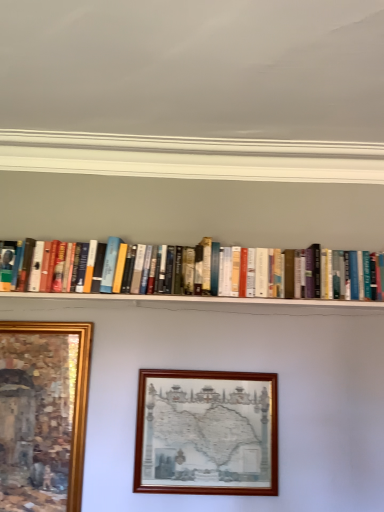
Describe the element at coordinates (120, 269) in the screenshot. The width and height of the screenshot is (384, 512). I see `hardcover books at center` at that location.

Measure the distance between point (260,277) and camera.

They are 5.50 feet apart.

What is the approximate width of wooden picture frame at center, placed as the 1th picture frame when sorted from right to left?

It is 2.60 inches.

You are a GUI agent. You are given a task and a screenshot of the screen. Output one action in this format:
    pyautogui.click(x=<x>, y=<y>)
    Task: Click on the hardcover books at center
    The width and height of the screenshot is (384, 512).
    Given the screenshot: What is the action you would take?
    pyautogui.click(x=120, y=269)

Where is `book behind the wooden picture frame at center, which is the second picture frame in left-to-right order`? book behind the wooden picture frame at center, which is the second picture frame in left-to-right order is located at coordinates (120, 269).

Is wooden picture frame at center, placed as the 1th picture frame when sorted from right to left, wider or thinner than hardcover books at center?

Clearly, wooden picture frame at center, placed as the 1th picture frame when sorted from right to left, has less width compared to hardcover books at center.

Considering their positions, is wooden picture frame at center, placed as the 1th picture frame when sorted from right to left, located in front of or behind hardcover books at center?

In the image, wooden picture frame at center, placed as the 1th picture frame when sorted from right to left, appears in front of hardcover books at center.

From the image's perspective, is wooden picture frame at center, which is the second picture frame in left-to-right order, located above or below hardcover books at center?

From the image's perspective, wooden picture frame at center, which is the second picture frame in left-to-right order, appears below hardcover books at center.

Identify the location of picture frame on the left of wooden picture frame at center, which is the second picture frame in left-to-right order. The height and width of the screenshot is (512, 384). (43, 414).

Consider the image. Which is correct: wooden picture frame at center, which is the second picture frame in left-to-right order, is inside gold-framed painting at lower left, the 2th picture frame viewed from the right, or outside of it?

Answer: wooden picture frame at center, which is the second picture frame in left-to-right order, is located beyond the bounds of gold-framed painting at lower left, the 2th picture frame viewed from the right.

Is the depth of wooden picture frame at center, which is the second picture frame in left-to-right order, greater than that of gold-framed painting at lower left, which is the 1th picture frame in left-to-right order?

Yes, it is behind gold-framed painting at lower left, which is the 1th picture frame in left-to-right order.

Would you consider wooden picture frame at center, which is the second picture frame in left-to-right order, to be distant from gold-framed painting at lower left, which is the 1th picture frame in left-to-right order?

That's not correct — wooden picture frame at center, which is the second picture frame in left-to-right order, is a little close to gold-framed painting at lower left, which is the 1th picture frame in left-to-right order.

Is gold-framed painting at lower left, the 2th picture frame viewed from the right, positioned in front of wooden picture frame at center, placed as the 1th picture frame when sorted from right to left?

Yes.

Is wooden picture frame at center, placed as the 1th picture frame when sorted from right to left, located within gold-framed painting at lower left, which is the 1th picture frame in left-to-right order?

No, wooden picture frame at center, placed as the 1th picture frame when sorted from right to left, is located outside of gold-framed painting at lower left, which is the 1th picture frame in left-to-right order.

The width and height of the screenshot is (384, 512). I want to click on picture frame positioned vertically above the wooden picture frame at center, placed as the 1th picture frame when sorted from right to left (from a real-world perspective), so click(x=43, y=414).

Does gold-framed painting at lower left, the 2th picture frame viewed from the right, have a greater height compared to wooden picture frame at center, which is the second picture frame in left-to-right order?

Yes.

From a real-world perspective, is hardcover books at center located higher than gold-framed painting at lower left, which is the 1th picture frame in left-to-right order?

Yes.

Which is more to the left, hardcover books at center or gold-framed painting at lower left, the 2th picture frame viewed from the right?

Positioned to the left is gold-framed painting at lower left, the 2th picture frame viewed from the right.

In the image, is hardcover books at center positioned in front of or behind gold-framed painting at lower left, which is the 1th picture frame in left-to-right order?

In the image, hardcover books at center appears behind gold-framed painting at lower left, which is the 1th picture frame in left-to-right order.

Is point (218, 250) less distant than point (77, 369)?

No, (218, 250) is further to viewer.

Is hardcover books at center turned away from wooden picture frame at center, which is the second picture frame in left-to-right order?

No.

Based on the photo, considering the sizes of objects hardcover books at center and wooden picture frame at center, placed as the 1th picture frame when sorted from right to left, in the image provided, who is wider, hardcover books at center or wooden picture frame at center, placed as the 1th picture frame when sorted from right to left,?

hardcover books at center is wider.

Is hardcover books at center outside of wooden picture frame at center, which is the second picture frame in left-to-right order?

That's correct, hardcover books at center is outside of wooden picture frame at center, which is the second picture frame in left-to-right order.

Looking at this image, does hardcover books at center touch wooden picture frame at center, placed as the 1th picture frame when sorted from right to left?

No, hardcover books at center is not with wooden picture frame at center, placed as the 1th picture frame when sorted from right to left.

How many degrees apart are the facing directions of gold-framed painting at lower left, the 2th picture frame viewed from the right, and hardcover books at center?

gold-framed painting at lower left, the 2th picture frame viewed from the right, and hardcover books at center are facing 1.55 degrees away from each other.

Which object is positioned more to the right, gold-framed painting at lower left, which is the 1th picture frame in left-to-right order, or hardcover books at center?

hardcover books at center is more to the right.

Looking at this image, from the image's perspective, would you say gold-framed painting at lower left, the 2th picture frame viewed from the right, is positioned over hardcover books at center?

Actually, gold-framed painting at lower left, the 2th picture frame viewed from the right, appears below hardcover books at center in the image.

Who is shorter, gold-framed painting at lower left, the 2th picture frame viewed from the right, or hardcover books at center?

hardcover books at center.

This screenshot has width=384, height=512. I want to click on picture frame that is on the right side of hardcover books at center, so click(x=206, y=433).

At what (x,y) coordinates should I click in order to perform the action: click on picture frame above the wooden picture frame at center, which is the second picture frame in left-to-right order (from a real-world perspective). Please return your answer as a coordinate pair (x, y). Image resolution: width=384 pixels, height=512 pixels. Looking at the image, I should click on (43, 414).

Considering their positions, is gold-framed painting at lower left, which is the 1th picture frame in left-to-right order, positioned further to hardcover books at center than wooden picture frame at center, placed as the 1th picture frame when sorted from right to left?

Based on the image, gold-framed painting at lower left, which is the 1th picture frame in left-to-right order, appears to be further to hardcover books at center.

From the picture: Which object lies nearer to the anchor point wooden picture frame at center, which is the second picture frame in left-to-right order, gold-framed painting at lower left, which is the 1th picture frame in left-to-right order, or hardcover books at center?

gold-framed painting at lower left, which is the 1th picture frame in left-to-right order, is positioned closer to the anchor wooden picture frame at center, which is the second picture frame in left-to-right order.

Based on their spatial positions, is hardcover books at center or gold-framed painting at lower left, which is the 1th picture frame in left-to-right order, closer to wooden picture frame at center, placed as the 1th picture frame when sorted from right to left?

The object closer to wooden picture frame at center, placed as the 1th picture frame when sorted from right to left, is gold-framed painting at lower left, which is the 1th picture frame in left-to-right order.

Looking at this image, from the image, which object appears to be nearer to gold-framed painting at lower left, the 2th picture frame viewed from the right, wooden picture frame at center, which is the second picture frame in left-to-right order, or hardcover books at center?

wooden picture frame at center, which is the second picture frame in left-to-right order.

Based on their spatial positions, is hardcover books at center or wooden picture frame at center, placed as the 1th picture frame when sorted from right to left, closer to gold-framed painting at lower left, which is the 1th picture frame in left-to-right order?

Based on the image, wooden picture frame at center, placed as the 1th picture frame when sorted from right to left, appears to be nearer to gold-framed painting at lower left, which is the 1th picture frame in left-to-right order.

When comparing their distances from hardcover books at center, does wooden picture frame at center, which is the second picture frame in left-to-right order, or gold-framed painting at lower left, which is the 1th picture frame in left-to-right order, seem closer?

Among the two, wooden picture frame at center, which is the second picture frame in left-to-right order, is located nearer to hardcover books at center.

Locate an element on the screen. book located between gold-framed painting at lower left, the 2th picture frame viewed from the right, and wooden picture frame at center, placed as the 1th picture frame when sorted from right to left, in the left-right direction is located at coordinates (120, 269).